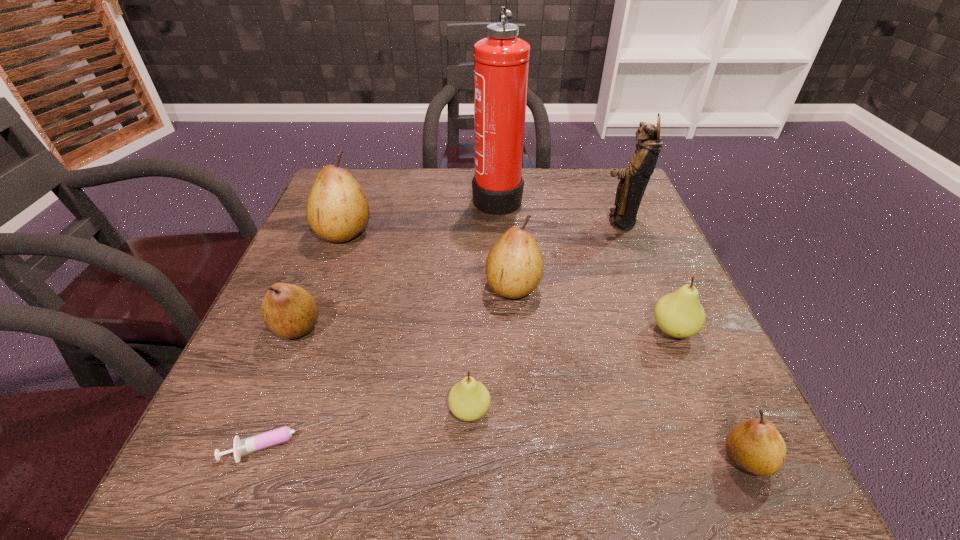
At what (x,y) coordinates should I click in order to perform the action: click on vacant space at the left edge of the desktop. Please return your answer as a coordinate pair (x, y). The height and width of the screenshot is (540, 960). Looking at the image, I should click on (343, 310).

At what (x,y) coordinates should I click in order to perform the action: click on vacant space at the right edge of the desktop. Please return your answer as a coordinate pair (x, y). Looking at the image, I should click on [684, 423].

In the image, there is a desktop. What are the coordinates of `vacant space at the near right corner` in the screenshot? It's located at (734, 470).

Where is `free space between the second tallest object and the third biggest brown pear`? The width and height of the screenshot is (960, 540). free space between the second tallest object and the third biggest brown pear is located at coordinates (458, 274).

Where is `free spot between the shortest object and the figurine`? free spot between the shortest object and the figurine is located at coordinates (448, 333).

Locate an element on the screen. vacant space that is in between the rightmost brown pear and the white syringe is located at coordinates (512, 451).

The image size is (960, 540). Find the location of `vacant region between the second tallest pear and the nearer green pear`. vacant region between the second tallest pear and the nearer green pear is located at coordinates (492, 349).

At what (x,y) coordinates should I click in order to perform the action: click on free space between the red fire extinguisher and the right green pear. Please return your answer as a coordinate pair (x, y). Looking at the image, I should click on (585, 264).

You are a GUI agent. You are given a task and a screenshot of the screen. Output one action in this format:
    pyautogui.click(x=<x>, y=<y>)
    Task: Click on the free space that is in between the farther green pear and the second farthest pear
    
    Given the screenshot: What is the action you would take?
    pyautogui.click(x=593, y=308)

The image size is (960, 540). What are the coordinates of `vacant area that lies between the biggest brown pear and the nearer green pear` in the screenshot? It's located at (407, 321).